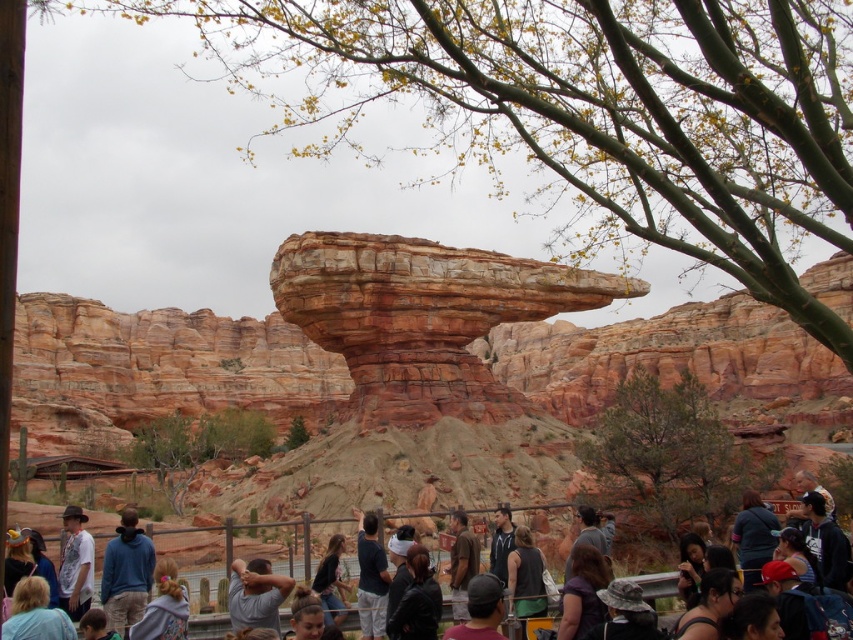
Can you confirm if black leather jacket at center is shorter than denim jacket at center?

Yes, black leather jacket at center is shorter than denim jacket at center.

Locate an element on the screen. black leather jacket at center is located at coordinates (416, 600).

Find the location of a particular element. This screenshot has height=640, width=853. black leather jacket at center is located at coordinates [416, 600].

Can you confirm if dark gray clothing at center is bigger than denim jacket at center?

Correct, dark gray clothing at center is larger in size than denim jacket at center.

What do you see at coordinates (656, 582) in the screenshot?
I see `dark gray clothing at center` at bounding box center [656, 582].

Does point (352, 618) come closer to viewer compared to point (340, 608)?

That is True.

I want to click on dark gray clothing at center, so click(x=656, y=582).

Who is more distant from viewer, (x=19, y=596) or (x=195, y=630)?

Positioned behind is point (x=195, y=630).

Is blonde hair at lower left smaller than dark gray clothing at center?

Indeed, blonde hair at lower left has a smaller size compared to dark gray clothing at center.

Between point (15, 621) and point (352, 611), which one is positioned in front?

Point (15, 621) is in front.

This screenshot has height=640, width=853. I want to click on blonde hair at lower left, so click(x=35, y=612).